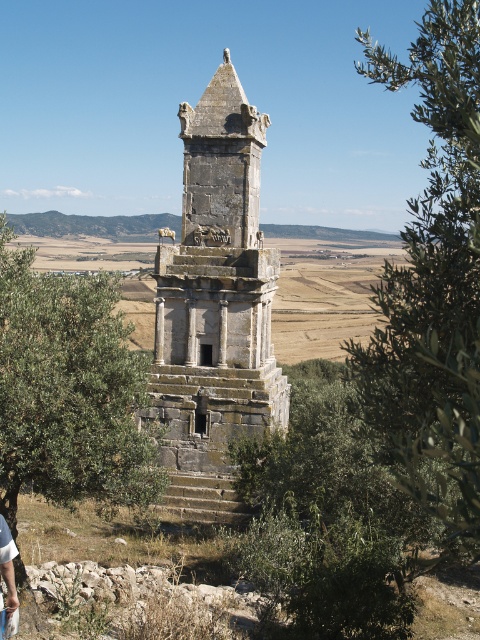
You are a traveler approaching the ancient stone monument. You notice the stone tower at center and the light brown leather pants at lower left. Which object is positioned higher in the image?

The stone tower at center is positioned higher than the light brown leather pants at lower left.